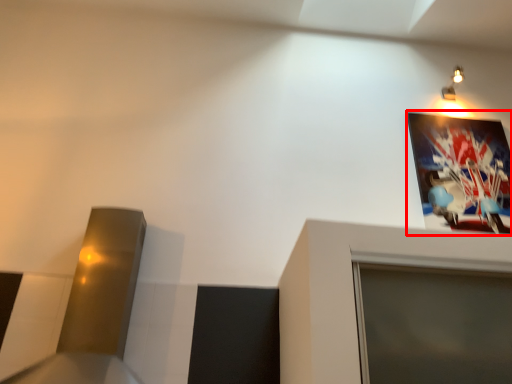
Question: From the image's perspective, where is picture frame (annotated by the red box) located in relation to light fixture in the image?

Choices:
 (A) below
 (B) above

Answer: (A)